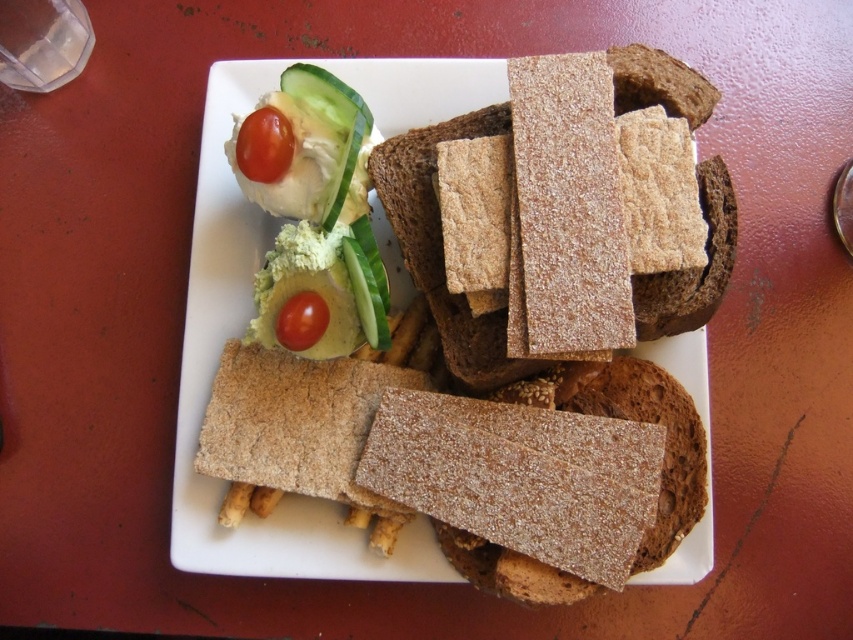
Question: Does brown textured bread at center come behind glossy red tomato at upper left?

Choices:
 (A) no
 (B) yes

Answer: (B)

Question: Does glossy red tomato at upper left lie behind glossy red tomato at center?

Choices:
 (A) no
 (B) yes

Answer: (A)

Question: Considering the real-world distances, which object is closest to the glossy red tomato at center?

Choices:
 (A) brown textured bread at center
 (B) glossy red tomato at upper left

Answer: (B)

Question: Which point is farther from the camera taking this photo?

Choices:
 (A) (257, 168)
 (B) (297, 310)
 (C) (372, 557)

Answer: (C)

Question: Which object is farther from the camera taking this photo?

Choices:
 (A) glossy red tomato at upper left
 (B) glossy red tomato at center

Answer: (B)

Question: Can you confirm if brown textured bread at center is thinner than glossy red tomato at center?

Choices:
 (A) yes
 (B) no

Answer: (B)